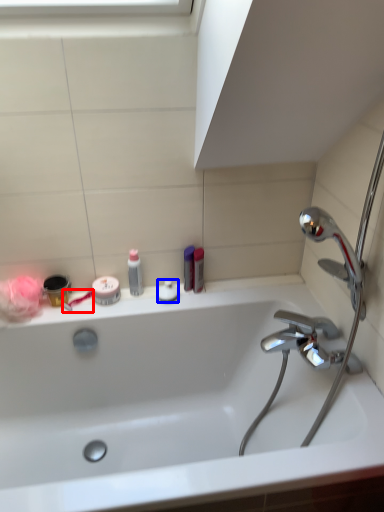
Question: Among these objects, which one is nearest to the camera, toothbrush (highlighted by a red box) or toiletry (highlighted by a blue box)?

Choices:
 (A) toothbrush
 (B) toiletry

Answer: (A)